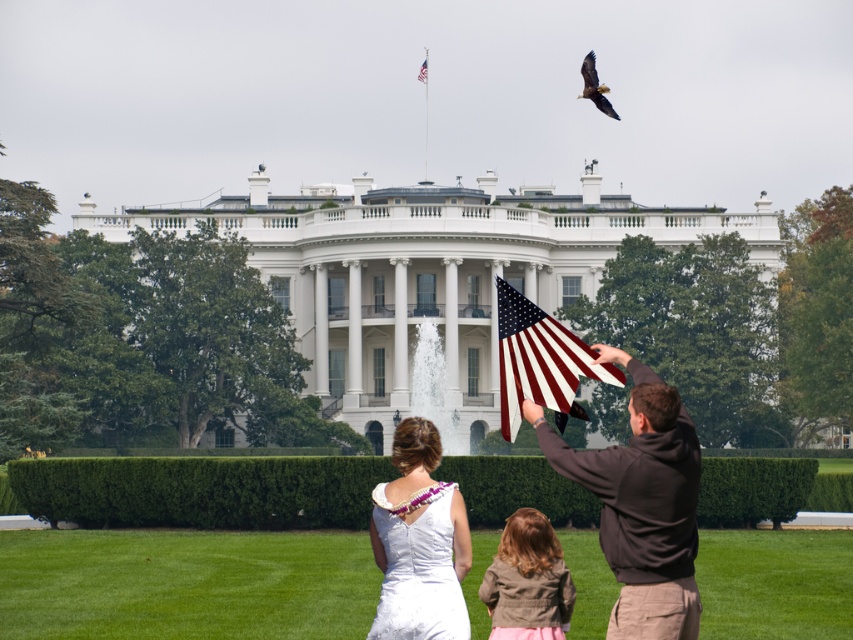
You are a photographer positioned on the South Lawn of the White House. You want to take a photo that includes both the matte brown hoodie at center and the brown feathered eagle at upper right. Which object will appear larger in the photo?

The matte brown hoodie at center will appear larger in the photo because it is closer to the viewer than the brown feathered eagle at upper right.

You are planning to take a photo of the matte brown hoodie at center and the brown feathered eagle at upper right. Which object should you focus on first if you want to include both in the frame without moving the camera?

You should focus on the matte brown hoodie at center first because it is larger and more prominent than the brown feathered eagle at upper right, ensuring it fits well within the frame.